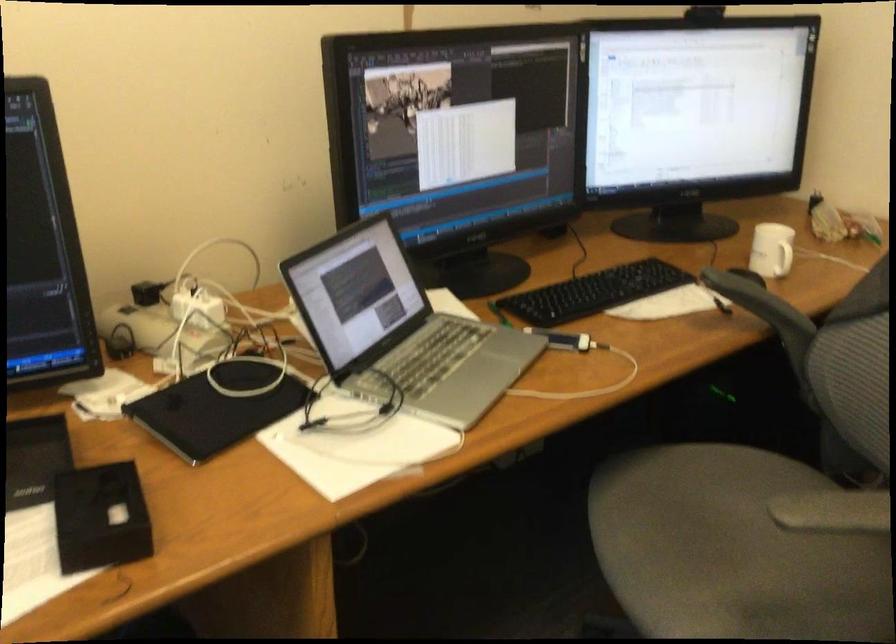
The image size is (896, 644). I want to click on chair sitting surface, so click(733, 550).